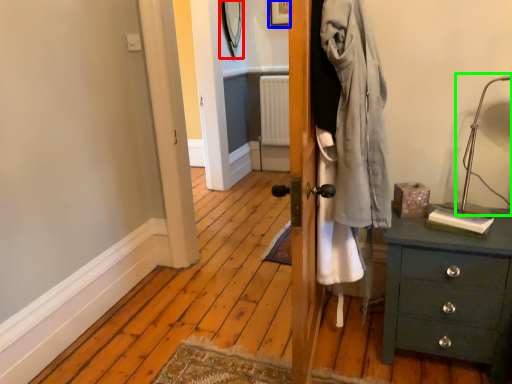
Question: Estimate the real-world distances between objects in this image. Which object is farther from mirror (highlighted by a red box), picture frame (highlighted by a blue box) or table lamp (highlighted by a green box)?

Choices:
 (A) picture frame
 (B) table lamp

Answer: (B)